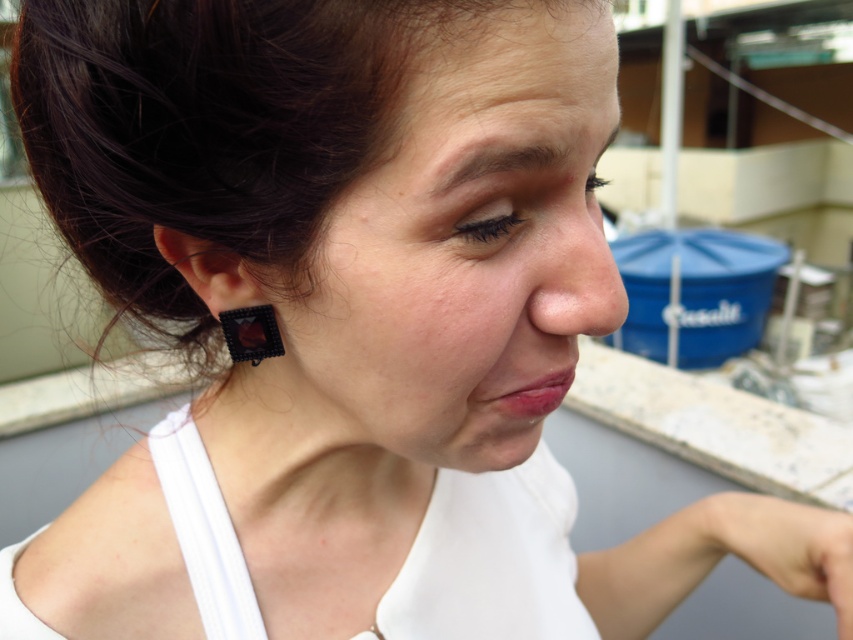
Question: Which object is positioned closest to the smooth skin nose at center?

Choices:
 (A) black beaded earring at ear
 (B) dark brown hair at upper center

Answer: (A)

Question: Which point is farther to the camera?

Choices:
 (A) smooth skin nose at center
 (B) black beaded earring at ear
 (C) dark brown hair at upper center

Answer: (B)

Question: Can you confirm if black beaded earring at ear is smaller than smooth skin nose at center?

Choices:
 (A) no
 (B) yes

Answer: (B)

Question: Does dark brown hair at upper center appear on the left side of black beaded earring at ear?

Choices:
 (A) yes
 (B) no

Answer: (B)

Question: Which point appears closest to the camera in this image?

Choices:
 (A) (257, 317)
 (B) (503, 150)
 (C) (595, 202)

Answer: (B)

Question: Where is dark brown hair at upper center located in relation to black beaded earring at ear in the image?

Choices:
 (A) right
 (B) left

Answer: (A)